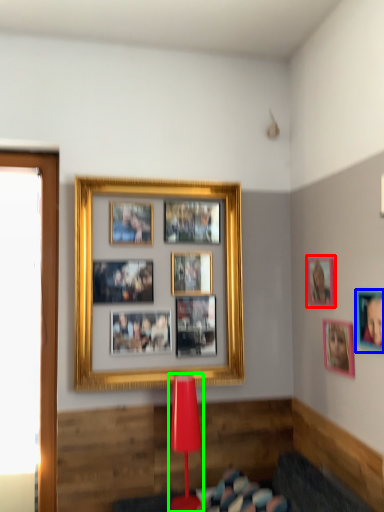
Question: Estimate the real-world distances between objects in this image. Which object is closer to picture frame (highlighted by a red box), picture frame (highlighted by a blue box) or table lamp (highlighted by a green box)?

Choices:
 (A) picture frame
 (B) table lamp

Answer: (A)